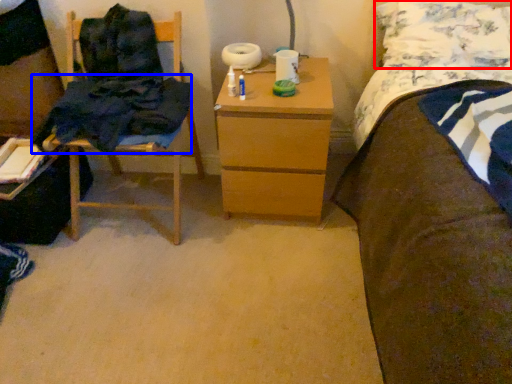
Question: Which object is closer to the camera taking this photo, pillow (highlighted by a red box) or clothing (highlighted by a blue box)?

Choices:
 (A) pillow
 (B) clothing

Answer: (B)